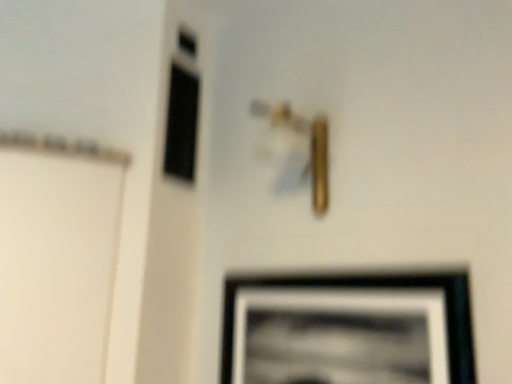
Question: Is black matte picture frame at lower right in front of or behind black glass window at upper left in the image?

Choices:
 (A) behind
 (B) front

Answer: (B)

Question: Is black matte picture frame at lower right taller or shorter than black glass window at upper left?

Choices:
 (A) tall
 (B) short

Answer: (B)

Question: Based on their relative distances, which object is nearer to the black matte picture frame at lower right?

Choices:
 (A) gold metallic door handle at center
 (B) black glass window at upper left

Answer: (A)

Question: Estimate the real-world distances between objects in this image. Which object is closer to the black glass window at upper left?

Choices:
 (A) black matte picture frame at lower right
 (B) gold metallic door handle at center

Answer: (B)